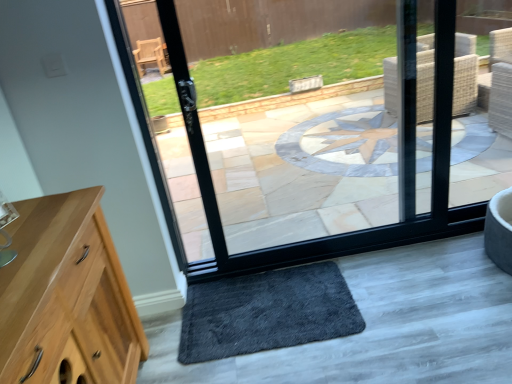
Identify the location of free point above dark gray shaggy mat at center (from a real-world perspective). This screenshot has width=512, height=384. (264, 307).